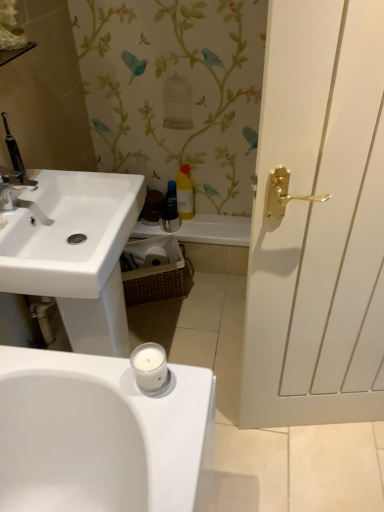
This screenshot has width=384, height=512. I want to click on vacant space in front of brown woven basket at center, so click(x=167, y=321).